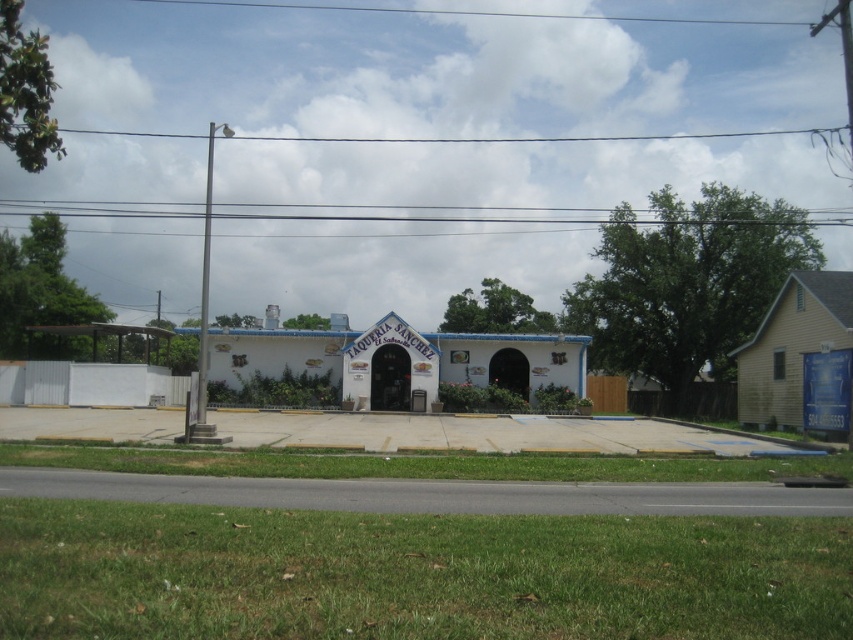
Which is more to the right, white stucco building at center or yellow wood house at right?

From the viewer's perspective, yellow wood house at right appears more on the right side.

Does white stucco building at center appear on the left side of yellow wood house at right?

Correct, you'll find white stucco building at center to the left of yellow wood house at right.

You are a GUI agent. You are given a task and a screenshot of the screen. Output one action in this format:
    pyautogui.click(x=<x>, y=<y>)
    Task: Click on the white stucco building at center
    
    Given the screenshot: What is the action you would take?
    pyautogui.click(x=390, y=362)

Identify the location of white stucco building at center. (390, 362).